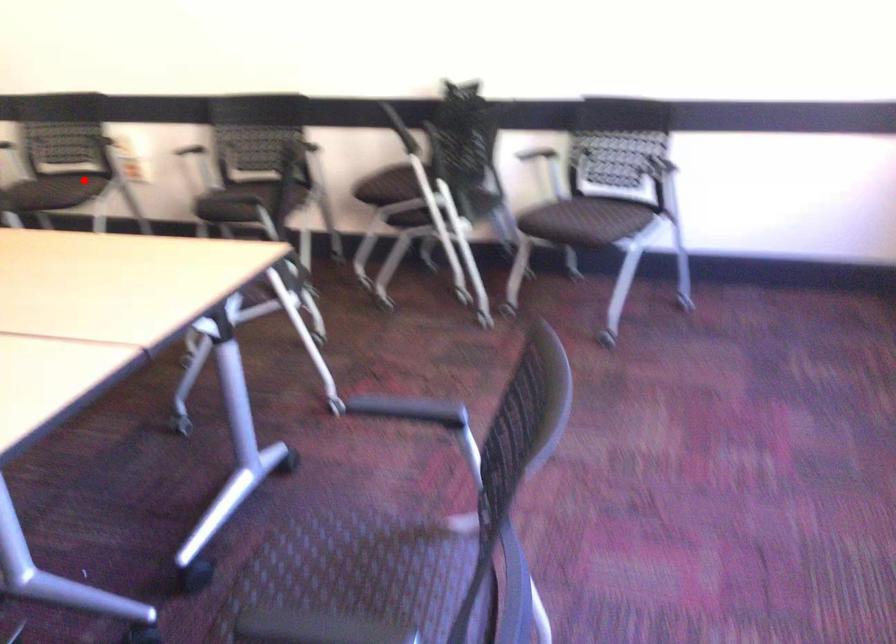
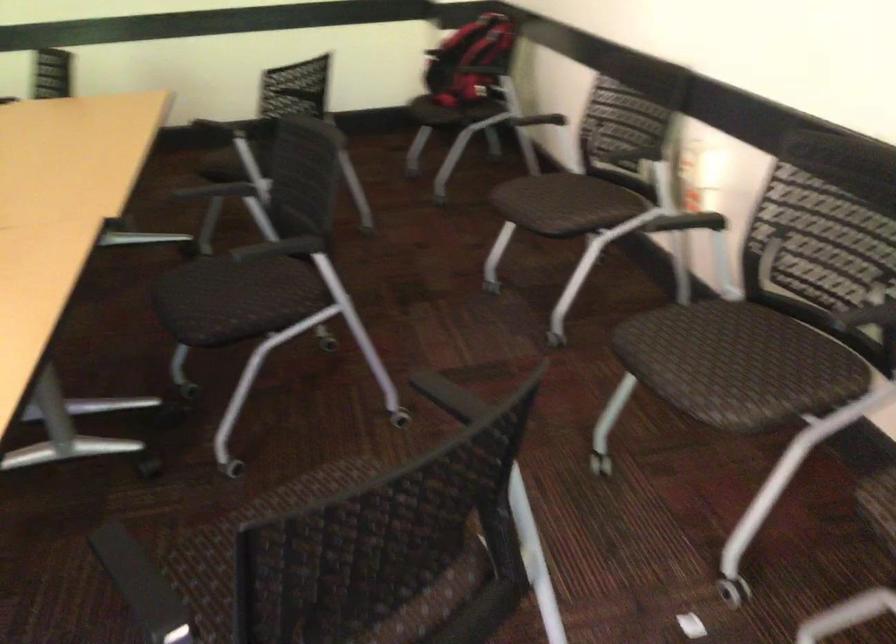
Where in the second image is the point corresponding to the highlighted location from the first image?

(581, 207)